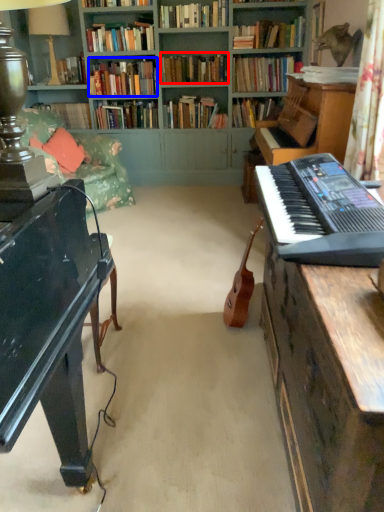
Question: Which object is further to the camera taking this photo, book (highlighted by a red box) or book (highlighted by a blue box)?

Choices:
 (A) book
 (B) book

Answer: (A)